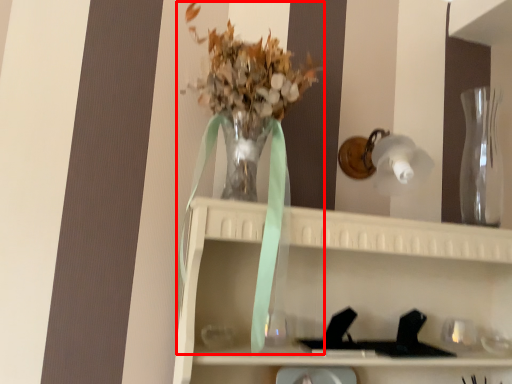
Question: Considering the relative positions of floral arrangement (annotated by the red box) and glass vase in the image provided, where is floral arrangement (annotated by the red box) located with respect to the staircase?

Choices:
 (A) right
 (B) left

Answer: (B)